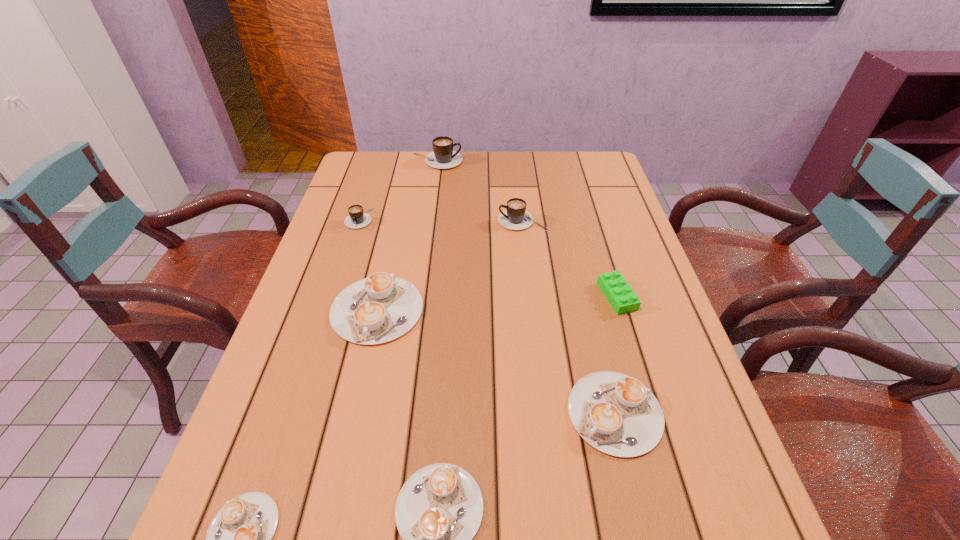
Where is `free space located with the handle on the side of the farthest black cappuccino`? free space located with the handle on the side of the farthest black cappuccino is located at coordinates (523, 161).

Where is `vacant space located 0.180m with the handle on the side of the rightmost black cappuccino`? This screenshot has height=540, width=960. vacant space located 0.180m with the handle on the side of the rightmost black cappuccino is located at coordinates (436, 221).

The image size is (960, 540). In order to click on free space located 0.350m with the handle on the side of the rightmost black cappuccino in this screenshot , I will do `click(378, 221)`.

Identify the location of free region located with the handle on the side of the rightmost black cappuccino. This screenshot has height=540, width=960. (385, 221).

Identify the location of vacant space situated with the handle on the side of the smallest black cappuccino. (342, 273).

The width and height of the screenshot is (960, 540). Identify the location of vacant region located on the back of the biggest white cappuccino. (399, 213).

Find the location of `free spot located on the left of the Lego`. free spot located on the left of the Lego is located at coordinates (566, 296).

This screenshot has height=540, width=960. I want to click on vacant space located 0.050m on the back of the second biggest white cappuccino, so click(601, 353).

Locate an element on the screen. This screenshot has width=960, height=540. object at the far edge is located at coordinates (443, 156).

This screenshot has width=960, height=540. What are the coordinates of `Lego present at the right edge` in the screenshot? It's located at (619, 294).